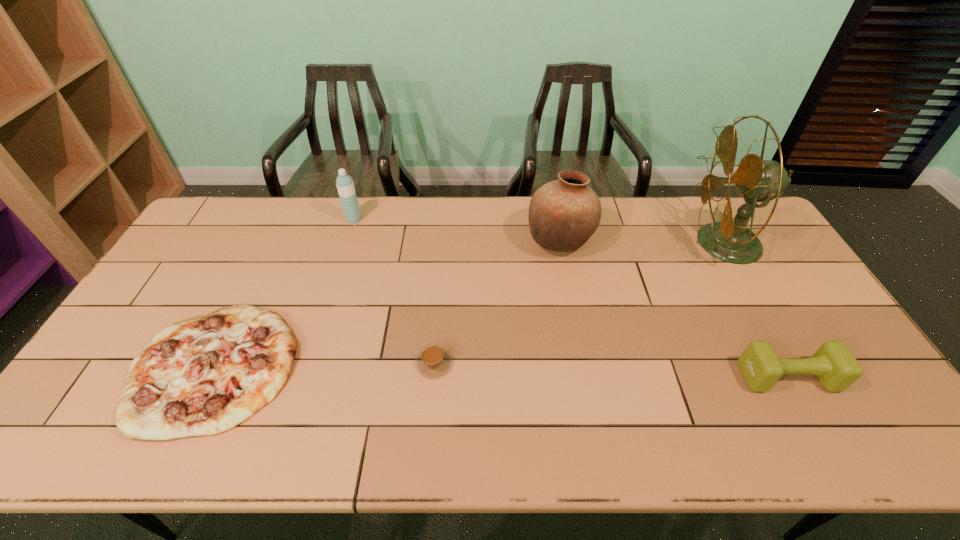
Find the location of a particular element. The height and width of the screenshot is (540, 960). vacant position located 0.070m in front of the tallest object, directing air flow is located at coordinates (670, 243).

You are a GUI agent. You are given a task and a screenshot of the screen. Output one action in this format:
    pyautogui.click(x=<x>, y=<y>)
    Task: Click on the free space located 0.170m on the left of the pottery
    Image resolution: width=960 pixels, height=540 pixels.
    Given the screenshot: What is the action you would take?
    pyautogui.click(x=475, y=241)

The image size is (960, 540). Identify the location of vacant area situated on the left of the fifth object from right to left. (299, 220).

The width and height of the screenshot is (960, 540). What are the coordinates of `vacant space located 0.150m on the back of the fourth tallest object` in the screenshot? It's located at (754, 316).

This screenshot has width=960, height=540. In order to click on vacant space located on the right of the cappuccino in this screenshot , I will do `click(599, 364)`.

Identify the location of vacant space situated 0.290m on the back of the pizza. (275, 241).

Where is `fan at the far edge`? fan at the far edge is located at coordinates (757, 180).

Find the location of `pottery located at the far edge`. pottery located at the far edge is located at coordinates (563, 214).

I want to click on water bottle that is positioned at the far edge, so click(x=345, y=186).

In order to click on object positioned at the near edge in this screenshot , I will do `click(203, 376)`.